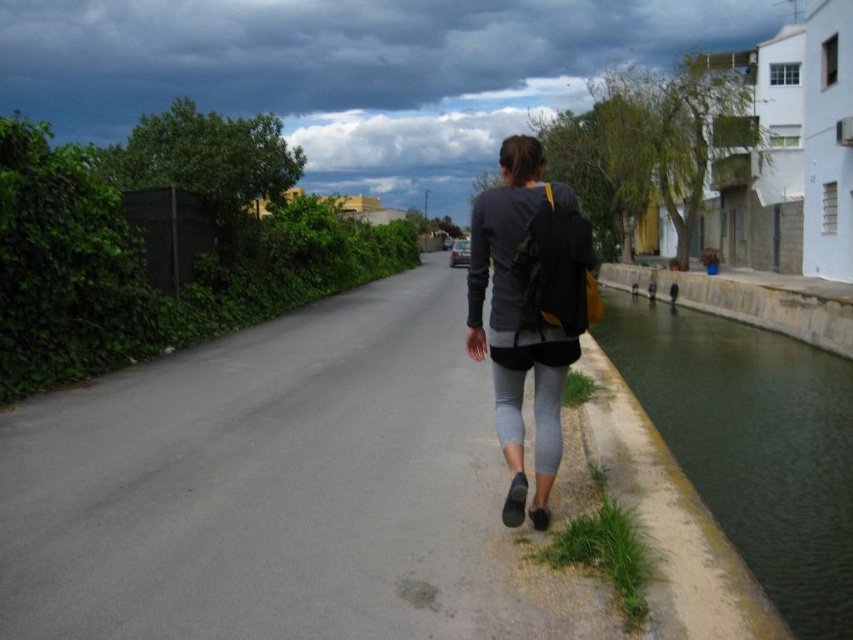
From the picture: Between gray asphalt road at center and gray matte leggings at center, which one is positioned lower?

gray asphalt road at center is lower down.

Locate an element on the screen. This screenshot has width=853, height=640. gray asphalt road at center is located at coordinates (279, 490).

Can you confirm if gray asphalt road at center is thinner than green concrete canal at right?

Yes.

Which of these two, gray asphalt road at center or green concrete canal at right, stands taller?

Standing taller between the two is green concrete canal at right.

What do you see at coordinates (279, 490) in the screenshot? The width and height of the screenshot is (853, 640). I see `gray asphalt road at center` at bounding box center [279, 490].

The width and height of the screenshot is (853, 640). Identify the location of gray asphalt road at center. (279, 490).

Which is in front, point (802, 554) or point (556, 196)?

Point (556, 196) is in front.

Can you confirm if green concrete canal at right is positioned above gray matte leggings at center?

Actually, green concrete canal at right is below gray matte leggings at center.

Which is in front, point (648, 403) or point (502, 244)?

Point (502, 244) is more forward.

Find the location of `green concrete canal at right`. green concrete canal at right is located at coordinates (752, 444).